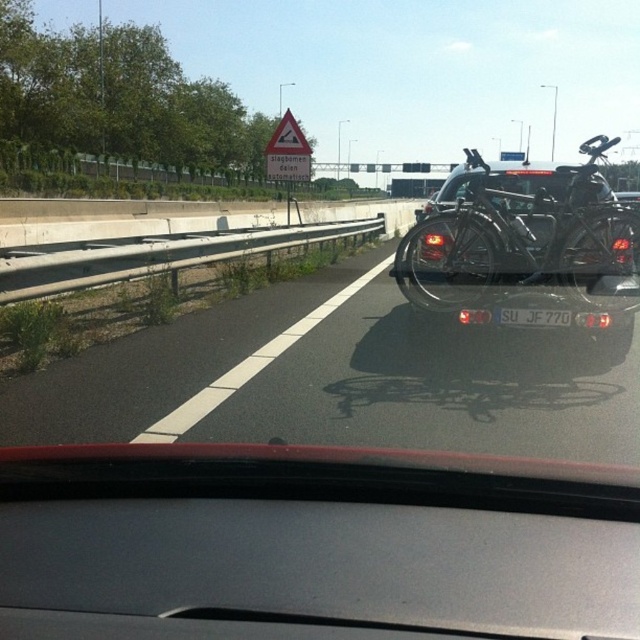
You are a driver observing the road ahead. Can you determine if the black asphalt road at center is wider than the shiny metallic bicycle at right?

The black asphalt road at center is wider than the shiny metallic bicycle at right according to the description.

You are driving and need to make a quick decision. Based on the scene, where is the shiny metallic bicycle at right in relation to the black asphalt road at center?

The shiny metallic bicycle at right is above the black asphalt road at center because the road is located below the bicycle.

Consider the image. You are driving a car that is 2.0 meters wide. You need to pass through the black asphalt road at center. Is the road wide enough to accommodate your car safely?

The black asphalt road at center is 4.60 meters from camera. Since the road width is greater than the car width of 2.0 meters, the road is wide enough to accommodate the car safely.